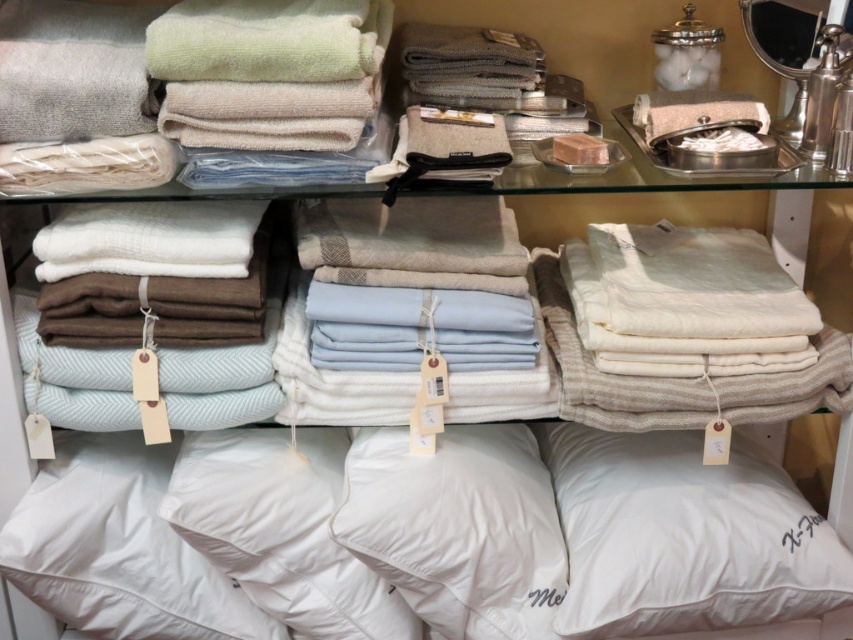
Question: Which point is closer to the camera?

Choices:
 (A) white cotton pillow at lower center
 (B) white soft pillow at lower right
 (C) white down pillow at center
 (D) white down-filled pillow at lower center

Answer: (A)

Question: Which point is closer to the camera?

Choices:
 (A) (625, 614)
 (B) (482, 536)

Answer: (A)

Question: Is white cotton pillow at lower center to the left of white down-filled pillow at lower center from the viewer's perspective?

Choices:
 (A) yes
 (B) no

Answer: (A)

Question: Considering the real-world distances, which object is farthest from the white soft pillow at lower right?

Choices:
 (A) white down pillow at center
 (B) white cotton pillow at lower center
 (C) white down-filled pillow at lower center

Answer: (B)

Question: Is white down pillow at center positioned at the back of white down-filled pillow at lower center?

Choices:
 (A) yes
 (B) no

Answer: (B)

Question: Does white soft pillow at lower right have a greater width compared to white cotton pillow at lower center?

Choices:
 (A) no
 (B) yes

Answer: (B)